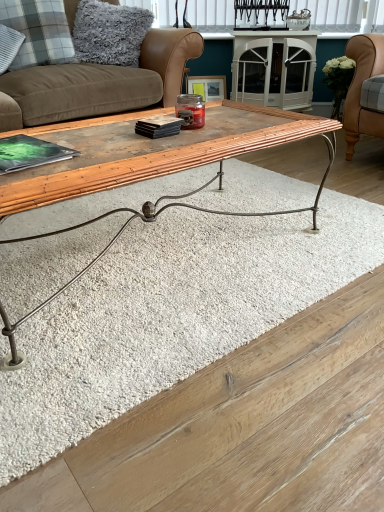
What do you see at coordinates (344, 15) in the screenshot? The width and height of the screenshot is (384, 512). I see `white blinds at upper center` at bounding box center [344, 15].

Where is `plaid fabric pillow at upper left, which is counted as the 1th pillow, starting from the left`? This screenshot has width=384, height=512. plaid fabric pillow at upper left, which is counted as the 1th pillow, starting from the left is located at coordinates (38, 31).

The width and height of the screenshot is (384, 512). I want to click on brown suede studio couch at upper left, so (x=98, y=84).

You are a GUI agent. You are given a task and a screenshot of the screen. Output one action in this format:
    pyautogui.click(x=<x>, y=<y>)
    Task: Click on the wooden bamboo coffee table at center
    
    Given the screenshot: What is the action you would take?
    pyautogui.click(x=178, y=156)

Measure the distance between point (35, 191) and camera.

They are 35.31 inches apart.

This screenshot has height=512, width=384. What are the coordinates of `white blinds at upper center` in the screenshot? It's located at coord(344,15).

Which object is positioned more to the right, wooden bamboo coffee table at center or wooden picture frame at center?

Positioned to the right is wooden picture frame at center.

Based on the photo, is wooden bamboo coffee table at center oriented towards wooden picture frame at center?

No, wooden bamboo coffee table at center is not turned towards wooden picture frame at center.

Would you say wooden bamboo coffee table at center is inside or outside wooden picture frame at center?

wooden bamboo coffee table at center lies outside wooden picture frame at center.

The image size is (384, 512). I want to click on picture frame behind the wooden bamboo coffee table at center, so click(207, 87).

Which is more to the right, brown suede studio couch at upper left or white blinds at upper center?

From the viewer's perspective, white blinds at upper center appears more on the right side.

From the image's perspective, would you say brown suede studio couch at upper left is shown under white blinds at upper center?

Yes, from the image's perspective, brown suede studio couch at upper left is beneath white blinds at upper center.

Is brown suede studio couch at upper left bigger or smaller than white blinds at upper center?

brown suede studio couch at upper left is bigger than white blinds at upper center.

Is point (142, 47) farther from viewer compared to point (348, 24)?

No, it is in front of (348, 24).

Considering the points (38, 56) and (118, 105), which point is behind, point (38, 56) or point (118, 105)?

The point (38, 56) is behind.

What are the coordinates of `studio couch below the plaid fabric pillow at upper left, the second pillow positioned from the right (from the image's perspective)` in the screenshot? It's located at (98, 84).

Consider the image. Considering the sizes of plaid fabric pillow at upper left, the second pillow positioned from the right, and brown suede studio couch at upper left in the image, is plaid fabric pillow at upper left, the second pillow positioned from the right, taller or shorter than brown suede studio couch at upper left?

Clearly, plaid fabric pillow at upper left, the second pillow positioned from the right, is shorter compared to brown suede studio couch at upper left.

Is plaid fabric pillow at upper left, which is counted as the 1th pillow, starting from the left, to the left of brown suede studio couch at upper left from the viewer's perspective?

Indeed, plaid fabric pillow at upper left, which is counted as the 1th pillow, starting from the left, is positioned on the left side of brown suede studio couch at upper left.

Who is smaller, wooden picture frame at center or plaid fabric pillow at upper left, which is counted as the 1th pillow, starting from the left?

wooden picture frame at center.

Which object is thinner, wooden picture frame at center or plaid fabric pillow at upper left, the second pillow positioned from the right?

wooden picture frame at center is thinner.

Is wooden picture frame at center taller than plaid fabric pillow at upper left, the second pillow positioned from the right?

In fact, wooden picture frame at center may be shorter than plaid fabric pillow at upper left, the second pillow positioned from the right.

Which is behind, point (301, 6) or point (213, 90)?

The point (213, 90) is farther from the camera.

Which of these two, white blinds at upper center or wooden picture frame at center, is smaller?

wooden picture frame at center.

From the image's perspective, is white blinds at upper center below wooden picture frame at center?

No, from the image's perspective, white blinds at upper center is not below wooden picture frame at center.

From the picture: Considering the relative positions of white blinds at upper center and wooden picture frame at center in the image provided, is white blinds at upper center to the left or to the right of wooden picture frame at center?

From the image, it's evident that white blinds at upper center is to the right of wooden picture frame at center.

Which object is positioned more to the right, white blinds at upper center or plaid fabric pillow at upper left, which is counted as the 1th pillow, starting from the left?

From the viewer's perspective, white blinds at upper center appears more on the right side.

Between white blinds at upper center and plaid fabric pillow at upper left, the second pillow positioned from the right, which one has smaller width?

white blinds at upper center is thinner.

Is white blinds at upper center smaller than plaid fabric pillow at upper left, the second pillow positioned from the right?

Indeed, white blinds at upper center has a smaller size compared to plaid fabric pillow at upper left, the second pillow positioned from the right.

At what (x,y) coordinates should I click in order to perform the action: click on window lying on the right of plaid fabric pillow at upper left, which is counted as the 1th pillow, starting from the left. Please return your answer as a coordinate pair (x, y). Looking at the image, I should click on coord(344,15).

Is plaid fabric pillow at upper left, the second pillow positioned from the right, oriented away from wooden bamboo coffee table at center?

plaid fabric pillow at upper left, the second pillow positioned from the right, is not turned away from wooden bamboo coffee table at center.

Image resolution: width=384 pixels, height=512 pixels. In order to click on coffee table located in front of the plaid fabric pillow at upper left, which is counted as the 1th pillow, starting from the left in this screenshot , I will do `click(178, 156)`.

How different are the orientations of plaid fabric pillow at upper left, which is counted as the 1th pillow, starting from the left, and wooden bamboo coffee table at center in degrees?

There is a 14.5-degree angle between the facing directions of plaid fabric pillow at upper left, which is counted as the 1th pillow, starting from the left, and wooden bamboo coffee table at center.

Which is closer, (16, 63) or (236, 118)?

Point (16, 63) is farther from the camera than point (236, 118).

Where is `picture frame above the wooden bamboo coffee table at center (from the image's perspective)`? This screenshot has width=384, height=512. picture frame above the wooden bamboo coffee table at center (from the image's perspective) is located at coordinates (207, 87).

Locate an element on the screen. The width and height of the screenshot is (384, 512). studio couch that is below the white blinds at upper center (from the image's perspective) is located at coordinates (98, 84).

Which object lies further to the anchor point white blinds at upper center, brown suede studio couch at upper left or wooden picture frame at center?

brown suede studio couch at upper left.

When comparing their distances from white blinds at upper center, does wooden picture frame at center or wooden bamboo coffee table at center seem further?

wooden bamboo coffee table at center lies further to white blinds at upper center than the other object.

Based on their spatial positions, is brown suede studio couch at upper left or wooden picture frame at center further from gray fluffy pillow at upper left, the 2th pillow viewed from the left?

Among the two, wooden picture frame at center is located further to gray fluffy pillow at upper left, the 2th pillow viewed from the left.

Based on the photo, which object lies nearer to the anchor point wooden bamboo coffee table at center, white blinds at upper center or brown suede studio couch at upper left?

brown suede studio couch at upper left lies closer to wooden bamboo coffee table at center than the other object.

Which object lies further to the anchor point wooden bamboo coffee table at center, plaid fabric pillow at upper left, the second pillow positioned from the right, or wooden picture frame at center?

wooden picture frame at center.

From the image, which object appears to be farther from brown suede studio couch at upper left, gray fluffy pillow at upper left, which ranks as the first pillow in right-to-left order, or wooden picture frame at center?

Among the two, wooden picture frame at center is located further to brown suede studio couch at upper left.

Looking at the image, which one is located closer to brown suede studio couch at upper left, wooden bamboo coffee table at center or wooden picture frame at center?

wooden picture frame at center is positioned closer to the anchor brown suede studio couch at upper left.

Looking at the image, which one is located further to wooden picture frame at center, gray fluffy pillow at upper left, which ranks as the first pillow in right-to-left order, or plaid fabric pillow at upper left, which is counted as the 1th pillow, starting from the left?

Among the two, plaid fabric pillow at upper left, which is counted as the 1th pillow, starting from the left, is located further to wooden picture frame at center.

Identify the location of picture frame located between gray fluffy pillow at upper left, which ranks as the first pillow in right-to-left order, and white blinds at upper center in the left-right direction. The width and height of the screenshot is (384, 512). (207, 87).

You are a GUI agent. You are given a task and a screenshot of the screen. Output one action in this format:
    pyautogui.click(x=<x>, y=<y>)
    Task: Click on the studio couch between plaid fabric pillow at upper left, the second pillow positioned from the right, and white blinds at upper center, in the horizontal direction
    The width and height of the screenshot is (384, 512).
    Given the screenshot: What is the action you would take?
    pyautogui.click(x=98, y=84)

You are a GUI agent. You are given a task and a screenshot of the screen. Output one action in this format:
    pyautogui.click(x=<x>, y=<y>)
    Task: Click on the pillow between plaid fabric pillow at upper left, which is counted as the 1th pillow, starting from the left, and wooden picture frame at center, in the horizontal direction
    
    Given the screenshot: What is the action you would take?
    pyautogui.click(x=109, y=33)

At what (x,y) coordinates should I click in order to perform the action: click on pillow between brown suede studio couch at upper left and gray fluffy pillow at upper left, which ranks as the first pillow in right-to-left order, in the front-back direction. Please return your answer as a coordinate pair (x, y). Looking at the image, I should click on (38, 31).